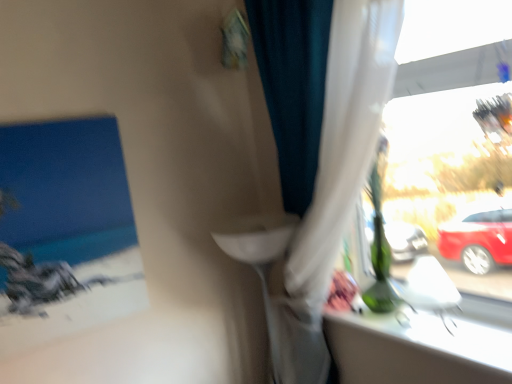
Question: From the image's perspective, is white sheer curtain at right above or below white glossy window sill at upper right?

Choices:
 (A) below
 (B) above

Answer: (B)

Question: Considering the positions of white sheer curtain at right and white glossy window sill at upper right in the image, is white sheer curtain at right taller or shorter than white glossy window sill at upper right?

Choices:
 (A) short
 (B) tall

Answer: (B)

Question: Is white sheer curtain at right inside the boundaries of white glossy window sill at upper right, or outside?

Choices:
 (A) outside
 (B) inside

Answer: (A)

Question: Looking at their shapes, would you say white glossy window sill at upper right is wider or thinner than white sheer curtain at right?

Choices:
 (A) thin
 (B) wide

Answer: (B)

Question: Which is correct: white glossy window sill at upper right is inside white sheer curtain at right, or outside of it?

Choices:
 (A) outside
 (B) inside

Answer: (A)

Question: From a real-world perspective, is white glossy window sill at upper right above or below white sheer curtain at right?

Choices:
 (A) above
 (B) below

Answer: (B)

Question: Does point (477, 304) appear closer or farther from the camera than point (346, 66)?

Choices:
 (A) closer
 (B) farther

Answer: (B)